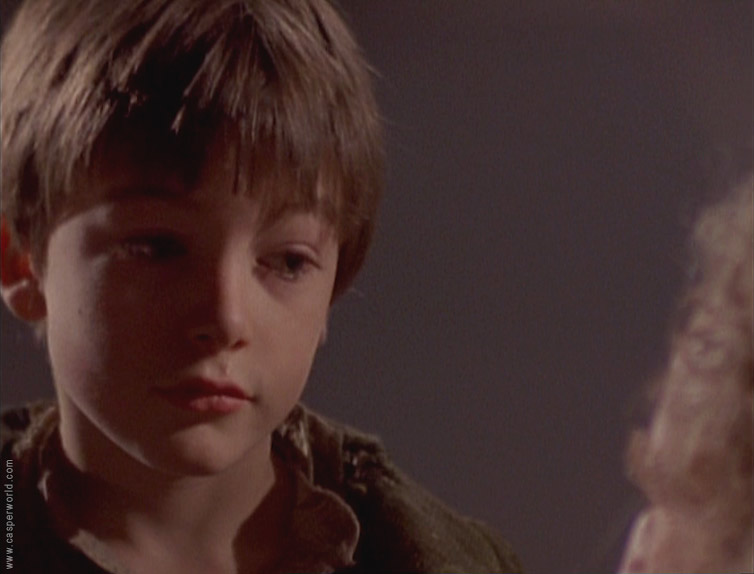
The width and height of the screenshot is (754, 574). What are the coordinates of `coat` in the screenshot? It's located at (424, 523).